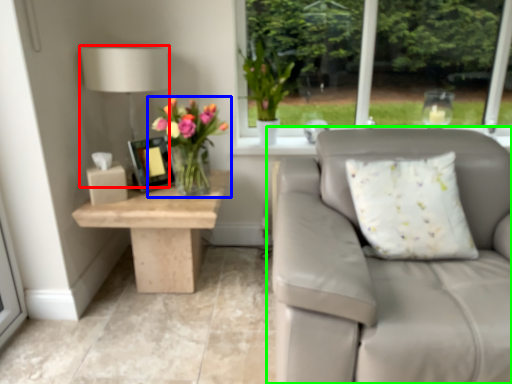
Question: Considering the real-world distances, which object is farthest from table lamp (highlighted by a red box)? houseplant (highlighted by a blue box) or studio couch (highlighted by a green box)?

Choices:
 (A) houseplant
 (B) studio couch

Answer: (B)